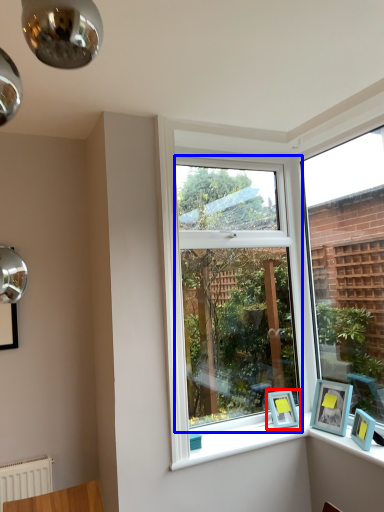
Question: Which object is further to the camera taking this photo, picture frame (highlighted by a red box) or window (highlighted by a blue box)?

Choices:
 (A) picture frame
 (B) window

Answer: (A)